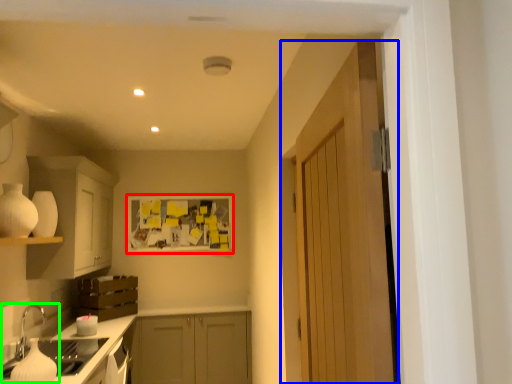
Question: Based on their relative distances, which object is farther from bulletin board (highlighted by a red box)? Choose from door (highlighted by a blue box) and sink (highlighted by a green box).

Choices:
 (A) door
 (B) sink

Answer: (A)